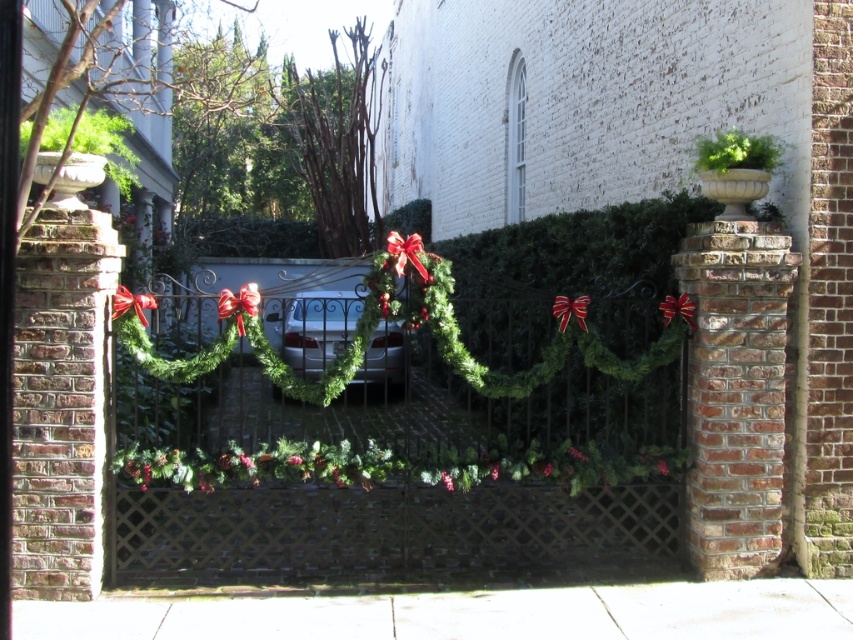
You are a delivery person arriving at this house and need to park your shiny silver car at center. The driveway is narrow. Can you fit your car between the green garland at center and the brick pillar to the right?

The green garland at center is larger in size than the shiny silver car at center. However, the description does not provide specific measurements for the distance between the garland and the pillar. Without knowing the exact space available, it is uncertain if the car will fit. Please check the actual space before attempting to park.

You are a delivery person trying to enter the residential area through the gate. You see the green garland at center and the shiny silver car at center. Which object is closer to the left side of the gate?

The shiny silver car at center is closer to the left side of the gate because the green garland at center is positioned on the right side of it.